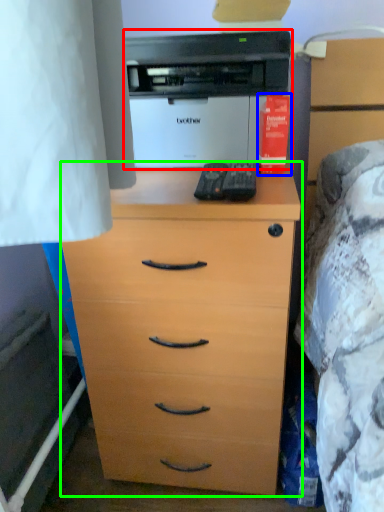
Question: Which is nearer to the printer (highlighted by a red box)? book (highlighted by a blue box) or chest of drawers (highlighted by a green box).

Choices:
 (A) book
 (B) chest of drawers

Answer: (A)